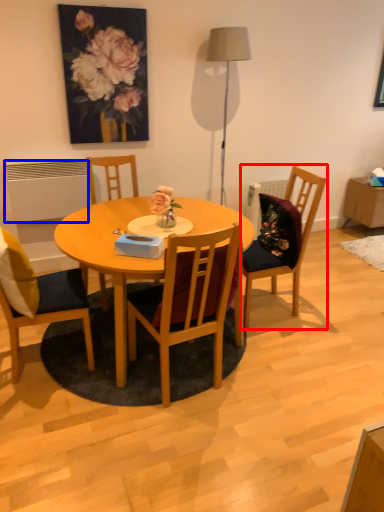
Question: Among these objects, which one is nearest to the camera, chair (highlighted by a red box) or radiator (highlighted by a blue box)?

Choices:
 (A) chair
 (B) radiator

Answer: (A)